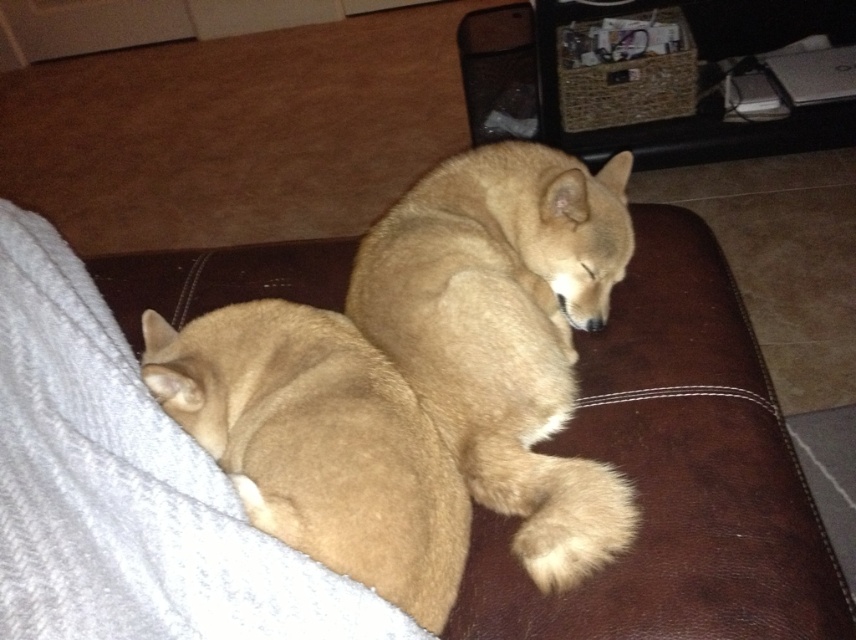
Question: Is gray fabric dog bed at lower left wider than fuzzy tan dog at lower left?

Choices:
 (A) no
 (B) yes

Answer: (B)

Question: Is gray fabric dog bed at lower left thinner than light brown fur at center?

Choices:
 (A) no
 (B) yes

Answer: (A)

Question: Which object appears farthest from the camera in this image?

Choices:
 (A) light brown fur at center
 (B) fuzzy tan dog at lower left

Answer: (A)

Question: Which object appears closest to the camera in this image?

Choices:
 (A) fuzzy tan dog at lower left
 (B) light brown fur at center
 (C) gray fabric dog bed at lower left

Answer: (C)

Question: Can you confirm if light brown fur at center is thinner than fuzzy tan dog at lower left?

Choices:
 (A) yes
 (B) no

Answer: (B)

Question: Which point is closer to the camera?

Choices:
 (A) (43, 420)
 (B) (393, 465)
 (C) (568, 470)

Answer: (A)